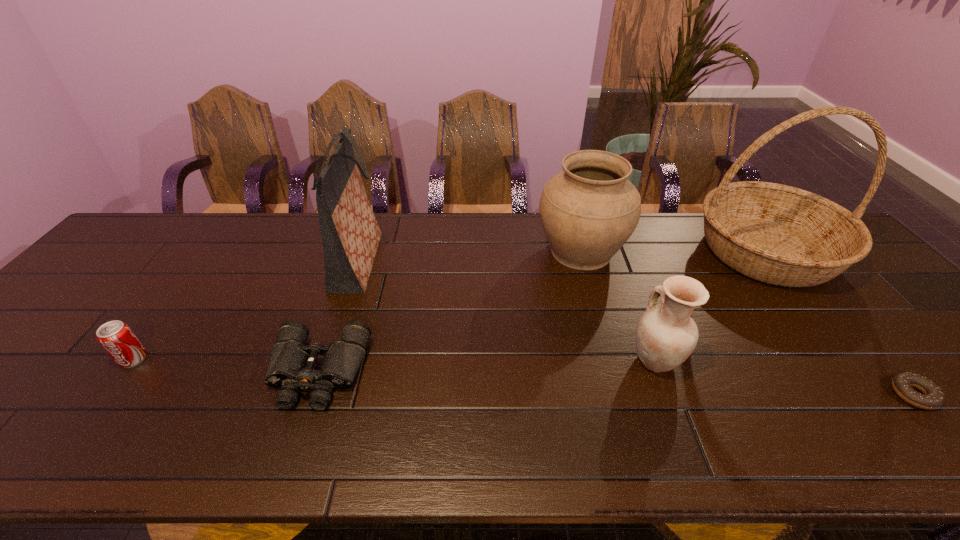
Find the location of `vacant space located 0.350m on the left of the third tallest object`. vacant space located 0.350m on the left of the third tallest object is located at coordinates (420, 251).

Identify the location of vacant space located 0.360m on the right of the fourth shortest object. The height and width of the screenshot is (540, 960). (837, 360).

Where is `free space located 0.330m on the back of the soda can`? The height and width of the screenshot is (540, 960). free space located 0.330m on the back of the soda can is located at coordinates (205, 262).

Locate an element on the screen. free space located on the left of the shortest object is located at coordinates (732, 395).

You are a GUI agent. You are given a task and a screenshot of the screen. Output one action in this format:
    pyautogui.click(x=<x>, y=<y>)
    Task: Click on the basket positioned at the far edge
    
    Given the screenshot: What is the action you would take?
    pyautogui.click(x=781, y=235)

This screenshot has width=960, height=540. I want to click on shopping bag located in the far edge section of the desktop, so click(350, 233).

Find the location of `urn at the far edge`. urn at the far edge is located at coordinates (588, 211).

The image size is (960, 540). I want to click on basket positioned at the right edge, so click(781, 235).

Image resolution: width=960 pixels, height=540 pixels. Find the location of `doughnut present at the right edge`. doughnut present at the right edge is located at coordinates (932, 398).

At what (x,y) coordinates should I click in order to perform the action: click on object at the far right corner. Please return your answer as a coordinate pair (x, y). Image resolution: width=960 pixels, height=540 pixels. Looking at the image, I should click on (781, 235).